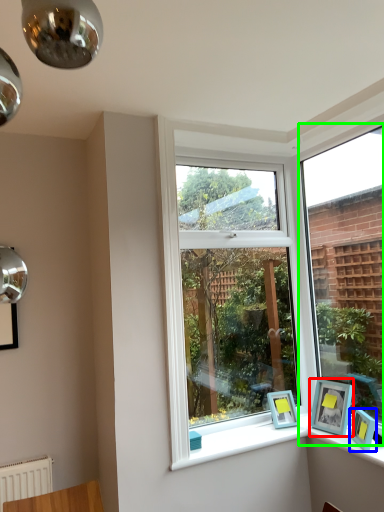
Question: Based on their relative distances, which object is farther from picture frame (highlighted by a red box)? Choose from picture frame (highlighted by a blue box) and window (highlighted by a green box).

Choices:
 (A) picture frame
 (B) window

Answer: (B)